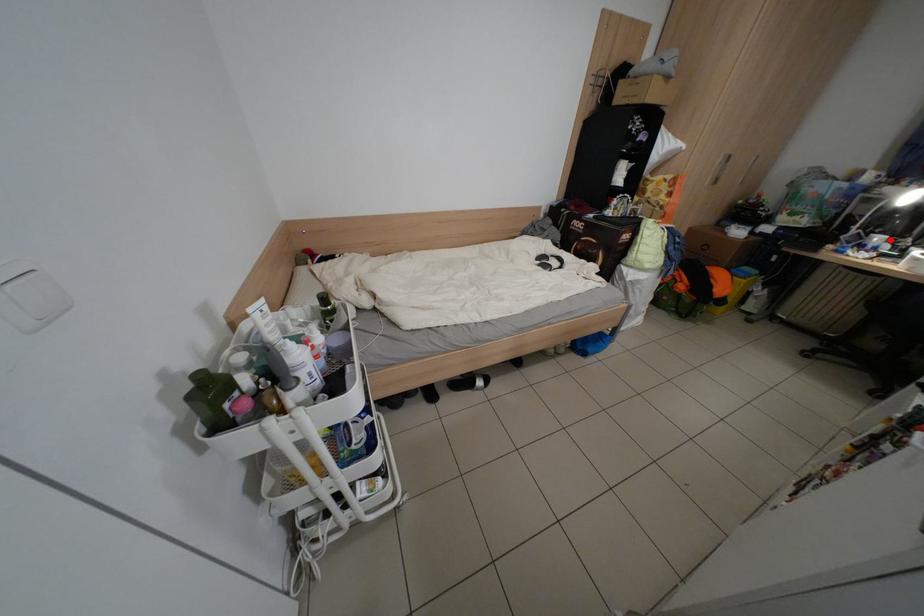
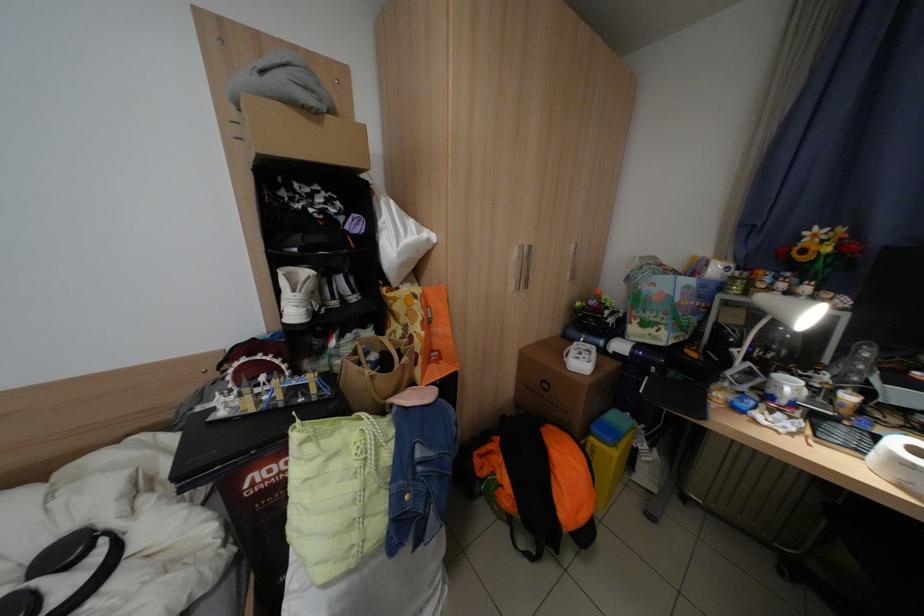
In the second image, find the point that corresponds to the highlighted location in the first image.

(800, 387)